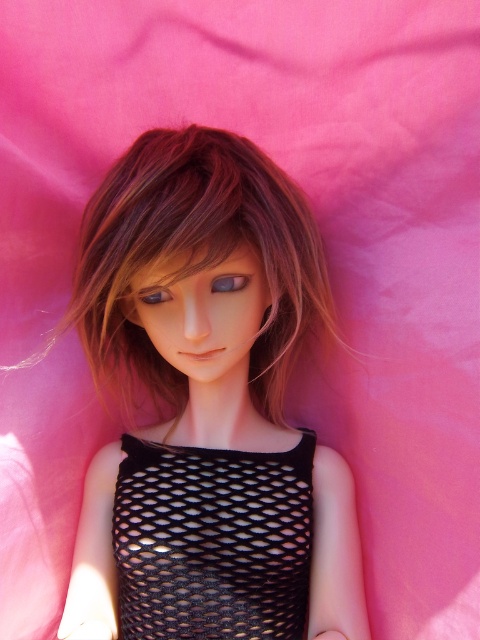
Question: Does purple glossy eye at center have a greater width compared to satin blue eye at center?

Choices:
 (A) no
 (B) yes

Answer: (B)

Question: Which object is farther from the camera taking this photo?

Choices:
 (A) satin blue eye at center
 (B) black mesh dress at center
 (C) satin black dress at center

Answer: (B)

Question: Which object is farther from the camera taking this photo?

Choices:
 (A) black mesh dress at center
 (B) purple glossy eye at center

Answer: (B)

Question: Does satin black dress at center appear on the right side of purple glossy eye at center?

Choices:
 (A) yes
 (B) no

Answer: (B)

Question: Can you confirm if purple glossy eye at center is positioned above satin blue eye at center?

Choices:
 (A) yes
 (B) no

Answer: (A)

Question: Among these objects, which one is farthest from the camera?

Choices:
 (A) satin blue eye at center
 (B) purple glossy eye at center
 (C) black mesh dress at center
 (D) satin black dress at center

Answer: (B)